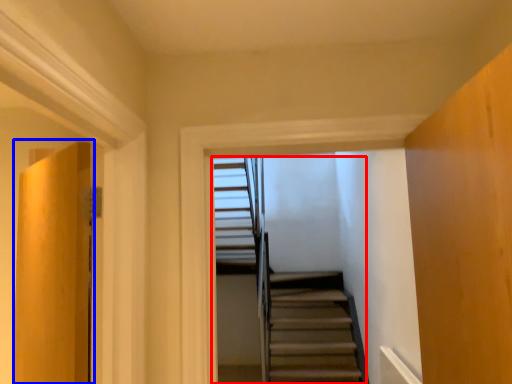
Question: Which of the following is the closest to the observer, stairs (highlighted by a red box) or door (highlighted by a blue box)?

Choices:
 (A) stairs
 (B) door

Answer: (B)